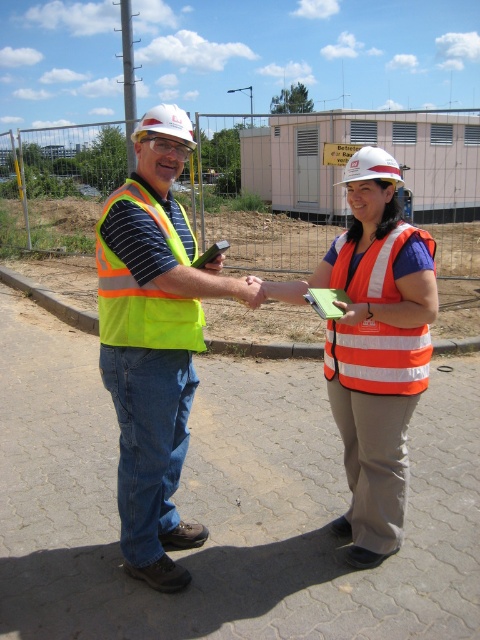
You are standing at the construction site and want to determine which of the two points, point [184,147] or point [373,504], is nearer to you. Based on the scene, which point is closer?

Point [184,147] is closer to the viewer than point [373,504].

From the picture: You are a safety inspector at the construction site and need to locate the neon yellow vest at center. What are its coordinates?

The neon yellow vest at center is located at point [154,340].

You are a drone operator tasked with capturing aerial footage of the construction site. The drone must hover exactly at the point marked by point (154, 340). From the current vantage point, which object should the drone be positioned directly above?

The point (154, 340) marks the neon yellow vest at center, so the drone should hover directly above the neon yellow vest at center.